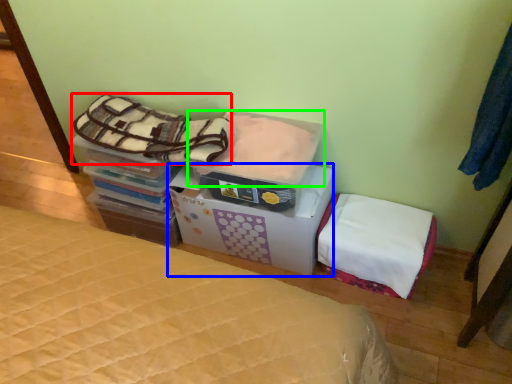
Question: Which is nearer to the blanket (highlighted by a red box)? cardboard box (highlighted by a blue box) or blanket (highlighted by a green box).

Choices:
 (A) cardboard box
 (B) blanket

Answer: (B)